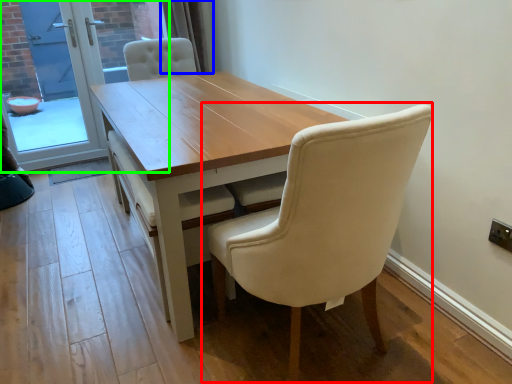
Question: Which object is the closest to the chair (highlighted by a red box)? Choose among these: curtain (highlighted by a blue box) or screen door (highlighted by a green box).

Choices:
 (A) curtain
 (B) screen door

Answer: (A)